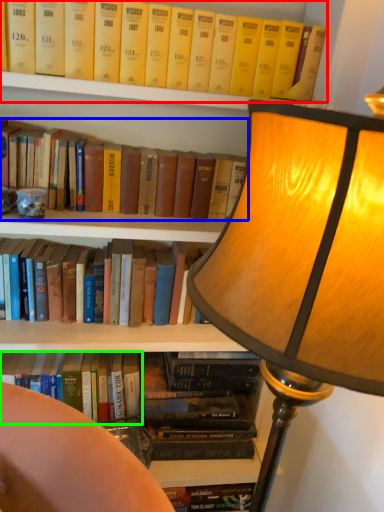
Question: Based on their relative distances, which object is nearer to book (highlighted by a red box)? Choose from book (highlighted by a blue box) and book (highlighted by a green box).

Choices:
 (A) book
 (B) book

Answer: (A)